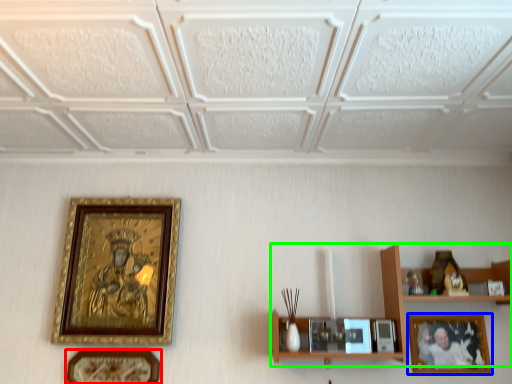
Question: Estimate the real-world distances between objects in this image. Which object is farther from picture frame (highlighted by a red box), picture frame (highlighted by a blue box) or shelf (highlighted by a green box)?

Choices:
 (A) picture frame
 (B) shelf

Answer: (A)